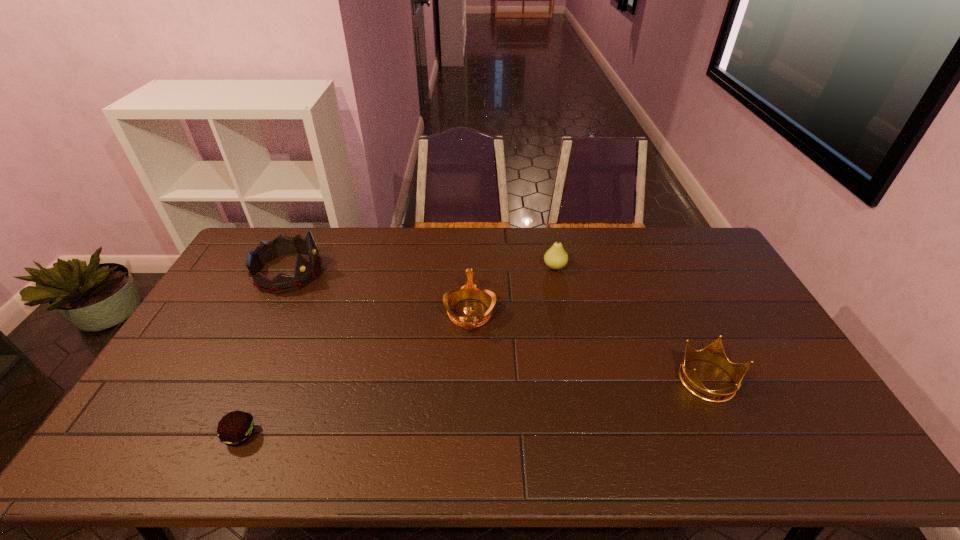
Find the location of a particular element. The width and height of the screenshot is (960, 540). blank area in the image that satisfies the following two spatial constraints: 1. on the front side of the pear; 2. at the front of the taller tiara with jewels is located at coordinates (556, 272).